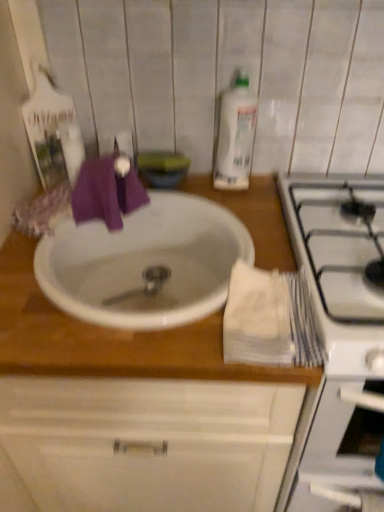
Question: Considering the relative sizes of white glossy sink at center and clear plastic bottle at upper center in the image provided, is white glossy sink at center taller than clear plastic bottle at upper center?

Choices:
 (A) no
 (B) yes

Answer: (A)

Question: Is clear plastic bottle at upper center at the back of white glossy sink at center?

Choices:
 (A) no
 (B) yes

Answer: (A)

Question: Is white glossy sink at center shorter than clear plastic bottle at upper center?

Choices:
 (A) no
 (B) yes

Answer: (B)

Question: Is white glossy sink at center closer to the viewer compared to clear plastic bottle at upper center?

Choices:
 (A) yes
 (B) no

Answer: (A)

Question: Does white glossy sink at center lie behind clear plastic bottle at upper center?

Choices:
 (A) yes
 (B) no

Answer: (B)

Question: From the image's perspective, is white glossy stove at right above or below white matte sink at center?

Choices:
 (A) above
 (B) below

Answer: (B)

Question: In the image, is white glossy stove at right positioned in front of or behind white matte sink at center?

Choices:
 (A) front
 (B) behind

Answer: (A)

Question: Based on their positions, is white glossy stove at right located to the left or right of white matte sink at center?

Choices:
 (A) right
 (B) left

Answer: (A)

Question: In terms of height, does white glossy stove at right look taller or shorter compared to white matte sink at center?

Choices:
 (A) short
 (B) tall

Answer: (A)

Question: From their relative heights in the image, would you say white glossy sink at center is taller or shorter than white matte sink at center?

Choices:
 (A) tall
 (B) short

Answer: (B)

Question: In terms of size, does white glossy sink at center appear bigger or smaller than white matte sink at center?

Choices:
 (A) small
 (B) big

Answer: (A)

Question: From the image's perspective, is white glossy sink at center above or below white matte sink at center?

Choices:
 (A) above
 (B) below

Answer: (A)

Question: In terms of width, does white glossy sink at center look wider or thinner when compared to white matte sink at center?

Choices:
 (A) wide
 (B) thin

Answer: (B)

Question: Visually, is clear plastic bottle at upper center positioned to the left or to the right of white glossy stove at right?

Choices:
 (A) left
 (B) right

Answer: (A)

Question: From a real-world perspective, is clear plastic bottle at upper center positioned above or below white glossy stove at right?

Choices:
 (A) below
 (B) above

Answer: (B)